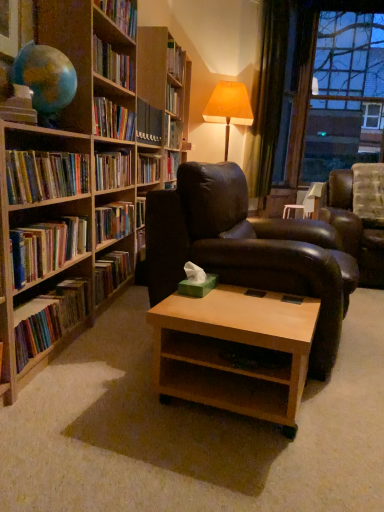
Describe the element at coordinates (345, 94) in the screenshot. This screenshot has width=384, height=512. I see `transparent glass window at upper right` at that location.

What do you see at coordinates (354, 229) in the screenshot?
I see `leather couch at right` at bounding box center [354, 229].

Consider the image. Measure the distance between green velvet curtain at upper right and camera.

green velvet curtain at upper right is 16.10 feet from camera.

Describe the element at coordinates (267, 98) in the screenshot. This screenshot has height=512, width=384. I see `green velvet curtain at upper right` at that location.

Find the location of `wooden bookcase at left`. wooden bookcase at left is located at coordinates (78, 182).

Image resolution: width=384 pixels, height=512 pixels. What do you see at coordinates (78, 182) in the screenshot? I see `wooden bookcase at left` at bounding box center [78, 182].

In order to face matte beige table lamp at upper right, should I rotate leftwards or rightwards?

Rotate right and turn 4.653 degrees.

Find the location of a particular element. transparent glass window at upper right is located at coordinates (345, 94).

In the image, is transparent glass window at upper right on the left side or the right side of multicolored paperbacks at left, placed as the 3th book when sorted from top to bottom?

From the image, it's evident that transparent glass window at upper right is to the right of multicolored paperbacks at left, placed as the 3th book when sorted from top to bottom.

Who is bigger, transparent glass window at upper right or multicolored paperbacks at left, which is the 1th book in bottom-to-top order?

With larger size is transparent glass window at upper right.

Consider the image. Can you confirm if transparent glass window at upper right is shorter than multicolored paperbacks at left, which is the 1th book in bottom-to-top order?

No.

Looking at this image, between transparent glass window at upper right and multicolored paperbacks at left, placed as the 3th book when sorted from top to bottom, which one is positioned in front?

multicolored paperbacks at left, placed as the 3th book when sorted from top to bottom.

Could wooden bookcase at left be considered to be inside leather couch at right?

Actually, wooden bookcase at left is outside leather couch at right.

Would you say leather couch at right is a long distance from wooden bookcase at left?

Yes, leather couch at right and wooden bookcase at left are located far from each other.

Which object is closer to the camera taking this photo, leather couch at right or wooden bookcase at left?

wooden bookcase at left is more forward.

Based on their positions, is leather couch at right located to the left or right of wooden bookcase at left?

Clearly, leather couch at right is on the right of wooden bookcase at left in the image.

Based on the photo, which is more to the right, transparent glass window at upper right or leather armchair at center?

Positioned to the right is transparent glass window at upper right.

Is transparent glass window at upper right not inside leather armchair at center?

Absolutely, transparent glass window at upper right is external to leather armchair at center.

From the image's perspective, which one is positioned lower, transparent glass window at upper right or leather armchair at center?

From the image's view, leather armchair at center is below.

Is hardcover books at left, which is the third book from bottom to top, closer to camera compared to light brown wood coffee table at center?

No, hardcover books at left, which is the third book from bottom to top, is behind light brown wood coffee table at center.

Which of these two, hardcover books at left, which is the third book from bottom to top, or light brown wood coffee table at center, is thinner?

Thinner between the two is hardcover books at left, which is the third book from bottom to top.

Visually, is hardcover books at left, the 1th book when ordered from top to bottom, positioned to the left or to the right of light brown wood coffee table at center?

Clearly, hardcover books at left, the 1th book when ordered from top to bottom, is on the left of light brown wood coffee table at center in the image.

From the image's perspective, which object appears higher, hardcover books at left, which is the third book from bottom to top, or light brown wood coffee table at center?

hardcover books at left, which is the third book from bottom to top, from the image's perspective.

From the image's perspective, which one is positioned lower, transparent glass window at upper right or wooden bookcase at left?

wooden bookcase at left.

Is transparent glass window at upper right shorter than wooden bookcase at left?

No, transparent glass window at upper right is not shorter than wooden bookcase at left.

Which object is more forward, transparent glass window at upper right or wooden bookcase at left?

wooden bookcase at left is in front.

This screenshot has height=512, width=384. What are the coordinates of `window screen that is above the wooden bookcase at left (from the image's perspective)` in the screenshot? It's located at (345, 94).

The width and height of the screenshot is (384, 512). There is a hardcover books at left, arranged as the second book when ordered from the bottom. Identify the location of window screen above it (from a real-world perspective). (345, 94).

Does point (320, 155) appear closer or farther from the camera than point (76, 247)?

Point (320, 155) is farther from the camera than point (76, 247).

Considering their positions, is transparent glass window at upper right located in front of or behind hardcover books at left, acting as the second book starting from the top?

Clearly, transparent glass window at upper right is behind hardcover books at left, acting as the second book starting from the top.

From a real-world perspective, is hardcover books at left, acting as the second book starting from the top, positioned under multicolored paperbacks at left, which is the 1th book in bottom-to-top order, based on gravity?

Actually, hardcover books at left, acting as the second book starting from the top, is physically above multicolored paperbacks at left, which is the 1th book in bottom-to-top order, in the real world.

Based on the photo, is multicolored paperbacks at left, which is the 1th book in bottom-to-top order, at the back of hardcover books at left, arranged as the second book when ordered from the bottom?

hardcover books at left, arranged as the second book when ordered from the bottom, does not have its back to multicolored paperbacks at left, which is the 1th book in bottom-to-top order.

Can multicolored paperbacks at left, placed as the 3th book when sorted from top to bottom, be found inside hardcover books at left, arranged as the second book when ordered from the bottom?

That's incorrect, multicolored paperbacks at left, placed as the 3th book when sorted from top to bottom, is not inside hardcover books at left, arranged as the second book when ordered from the bottom.

Is hardcover books at left, acting as the second book starting from the top, further to the viewer compared to multicolored paperbacks at left, placed as the 3th book when sorted from top to bottom?

No, it is not.

The image size is (384, 512). I want to click on window screen located behind the multicolored paperbacks at left, which is the 1th book in bottom-to-top order, so click(345, 94).

Find the location of a particular element. bookcase that appears on the left of leather couch at right is located at coordinates (78, 182).

Looking at the image, which one is located closer to hardcover books at left, the 1th book when ordered from top to bottom, leather armchair at center or multicolored paperbacks at left, which is the 1th book in bottom-to-top order?

multicolored paperbacks at left, which is the 1th book in bottom-to-top order.

Which object lies nearer to the anchor point matte beige table lamp at upper right, light brown wood coffee table at center or hardcover books at left, arranged as the second book when ordered from the bottom?

hardcover books at left, arranged as the second book when ordered from the bottom.

Considering their positions, is multicolored paperbacks at left, which is the 1th book in bottom-to-top order, positioned further to leather armchair at center than hardcover books at left, acting as the second book starting from the top?

hardcover books at left, acting as the second book starting from the top.

Considering their positions, is hardcover books at left, acting as the second book starting from the top, positioned closer to multicolored paperbacks at left, which is the 1th book in bottom-to-top order, than hardcover books at left, which is the third book from bottom to top?

hardcover books at left, acting as the second book starting from the top, is closer to multicolored paperbacks at left, which is the 1th book in bottom-to-top order.

Considering their positions, is hardcover books at left, the 1th book when ordered from top to bottom, positioned closer to wooden bookcase at left than transparent glass window at upper right?

hardcover books at left, the 1th book when ordered from top to bottom.

Looking at the image, which one is located closer to matte beige table lamp at upper right, hardcover books at left, acting as the second book starting from the top, or light brown wood coffee table at center?

hardcover books at left, acting as the second book starting from the top, is positioned closer to the anchor matte beige table lamp at upper right.

When comparing their distances from light brown wood coffee table at center, does matte beige table lamp at upper right or wooden bookcase at left seem closer?

Based on the image, wooden bookcase at left appears to be nearer to light brown wood coffee table at center.

Considering their positions, is transparent glass window at upper right positioned further to green velvet curtain at upper right than light brown wood coffee table at center?

light brown wood coffee table at center.

Locate an element on the screen. Image resolution: width=384 pixels, height=512 pixels. studio couch between wooden bookshelf at center and transparent glass window at upper right from left to right is located at coordinates (354, 229).

Locate an element on the screen. The image size is (384, 512). bookcase between hardcover books at left, acting as the second book starting from the top, and leather armchair at center is located at coordinates (78, 182).

This screenshot has width=384, height=512. Identify the location of studio couch positioned between wooden bookcase at left and matte beige table lamp at upper right from near to far. (354, 229).

Image resolution: width=384 pixels, height=512 pixels. Identify the location of chair between wooden bookcase at left and transparent glass window at upper right from front to back. (247, 250).